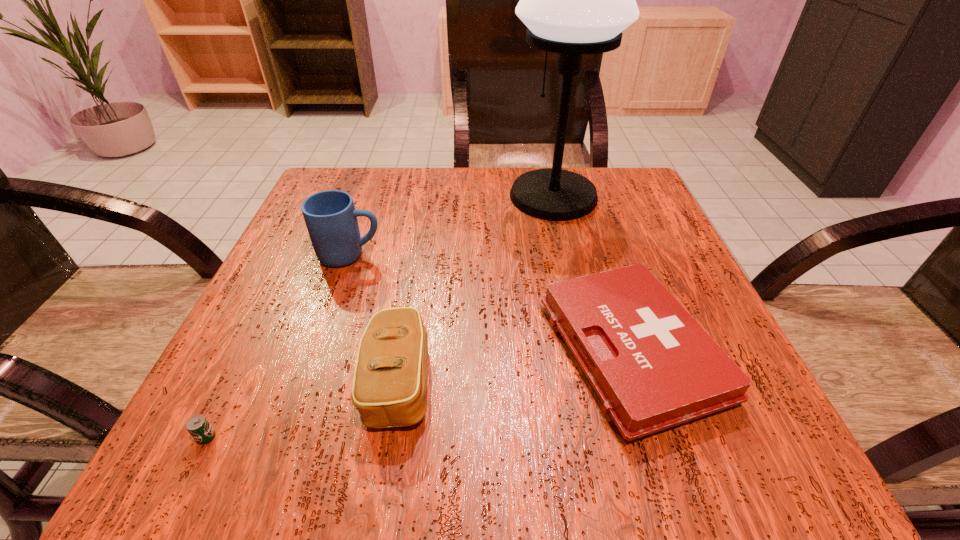
Locate an element on the screen. This screenshot has width=960, height=540. table lamp present at the right edge is located at coordinates (575, 0).

Locate an element on the screen. The width and height of the screenshot is (960, 540). the first-aid kit present at the right edge is located at coordinates (x=652, y=366).

Locate an element on the screen. This screenshot has width=960, height=540. object present at the near left corner is located at coordinates (198, 426).

Where is `object located in the far right corner section of the desktop`? object located in the far right corner section of the desktop is located at coordinates (575, 0).

Identify the location of object positioned at the near right corner. This screenshot has width=960, height=540. (652, 366).

Identify the location of free space at the far edge of the desktop. (418, 188).

Find the location of a particular element. This screenshot has height=540, width=960. blank area at the near edge is located at coordinates (495, 428).

The height and width of the screenshot is (540, 960). I want to click on vacant space at the left edge of the desktop, so click(290, 239).

Identify the location of vacant space at the right edge. (624, 255).

Find the location of a particular element. Image resolution: width=960 pixels, height=540 pixels. vacant space at the far left corner of the desktop is located at coordinates 367,171.